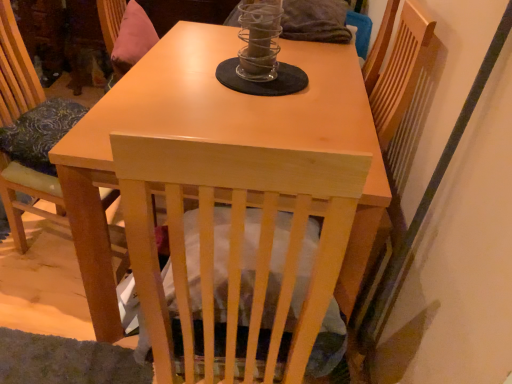
Question: From a real-world perspective, is clear glass candle holder at center physically above light wood table at center?

Choices:
 (A) no
 (B) yes

Answer: (B)

Question: Is clear glass candle holder at center next to light wood table at center and touching it?

Choices:
 (A) yes
 (B) no

Answer: (B)

Question: Are clear glass candle holder at center and light wood table at center far apart?

Choices:
 (A) yes
 (B) no

Answer: (B)

Question: Is light wood table at center a part of clear glass candle holder at center?

Choices:
 (A) yes
 (B) no

Answer: (B)

Question: Does clear glass candle holder at center have a greater width compared to light wood table at center?

Choices:
 (A) yes
 (B) no

Answer: (B)

Question: Considering the positions of clear glass candle holder at center and light wood chair at left in the image, is clear glass candle holder at center wider or thinner than light wood chair at left?

Choices:
 (A) thin
 (B) wide

Answer: (A)

Question: From a real-world perspective, is clear glass candle holder at center physically located above or below light wood chair at left?

Choices:
 (A) above
 (B) below

Answer: (A)

Question: Considering the positions of clear glass candle holder at center and light wood chair at left in the image, is clear glass candle holder at center taller or shorter than light wood chair at left?

Choices:
 (A) tall
 (B) short

Answer: (B)

Question: Is clear glass candle holder at center situated inside light wood chair at left or outside?

Choices:
 (A) outside
 (B) inside

Answer: (A)

Question: Considering their positions, is light wood table at center located in front of or behind light wood chair at left?

Choices:
 (A) behind
 (B) front

Answer: (B)

Question: Is light wood table at center taller or shorter than light wood chair at left?

Choices:
 (A) tall
 (B) short

Answer: (A)

Question: Visually, is light wood table at center positioned to the left or to the right of light wood chair at left?

Choices:
 (A) right
 (B) left

Answer: (A)

Question: From a real-world perspective, relative to light wood chair at left, is light wood table at center vertically above or below?

Choices:
 (A) above
 (B) below

Answer: (A)

Question: Considering their positions, is light wood chair at left located in front of or behind light wood table at center?

Choices:
 (A) behind
 (B) front

Answer: (A)

Question: Is light wood chair at left wider or thinner than light wood table at center?

Choices:
 (A) wide
 (B) thin

Answer: (B)